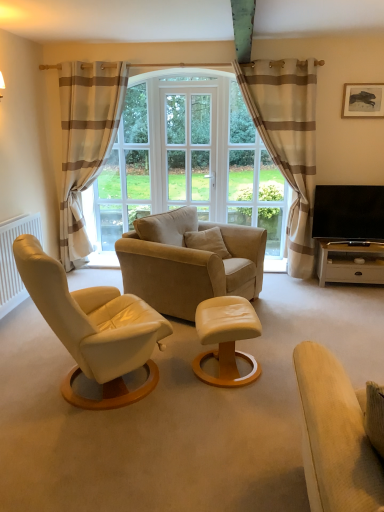
Locate an element on the screen. vacant space that is in between matte leather ottoman at center, which is the second table in back-to-front order, and light beige fabric studio couch at lower right is located at coordinates (259, 426).